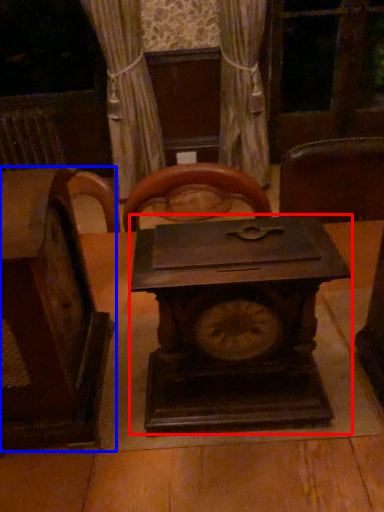
Question: Which of the following is the closest to the observer, clock (highlighted by a red box) or furniture (highlighted by a blue box)?

Choices:
 (A) clock
 (B) furniture

Answer: (B)